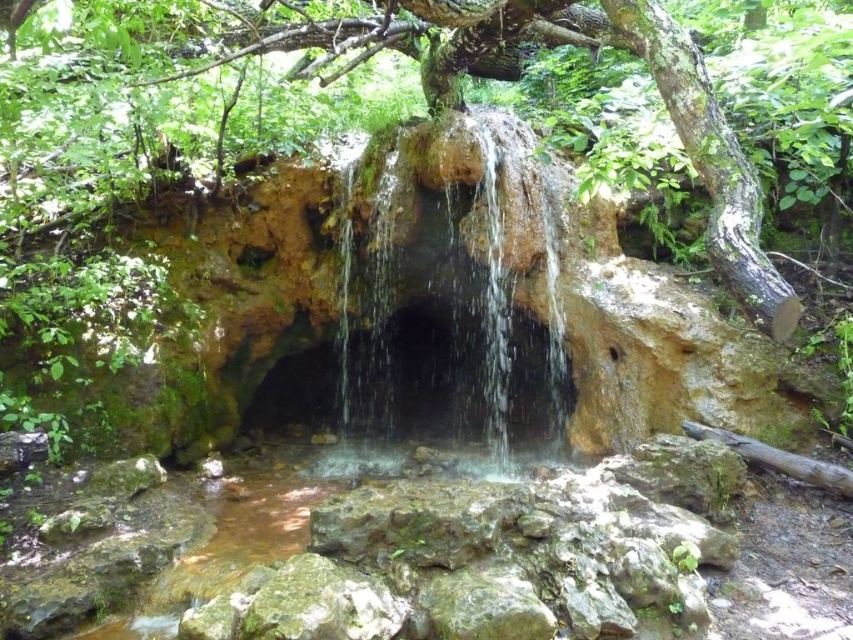
You are standing at the base of the waterfall and notice a point marked at coordinates (665, 108). According to the scene description, what object is located at that specific coordinate?

The point at coordinates (665, 108) indicates the location of the green mossy tree at upper center.

You are standing at the base of the waterfall and want to take a photo of both the point at coordinates point (x=492, y=129) and point (x=766, y=276). Which point should you focus on first to ensure both are in focus?

You should focus on point (x=492, y=129) first because it is closer to the camera than point (x=766, y=276), ensuring both points will be in focus when using a proper depth of field.

You are a hiker who wants to cross the shallow pool below the waterfall. You see the translucent rock waterfall at center and the brown rough log at lower right. Which object can you use as a stepping stone to cross the pool safely?

The brown rough log at lower right can be used as a stepping stone to cross the pool safely because it is smaller and more stable underfoot compared to the translucent rock waterfall at center.